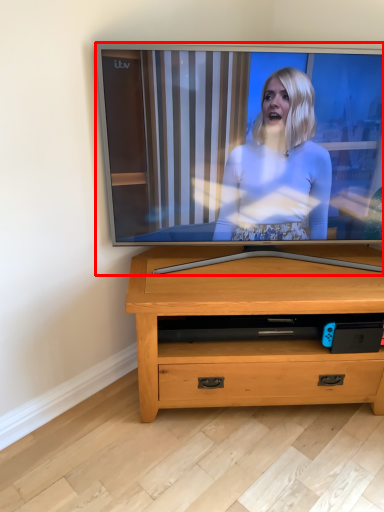
Question: From the image's perspective, where is television (annotated by the red box) located relative to chest of drawers?

Choices:
 (A) above
 (B) below

Answer: (A)